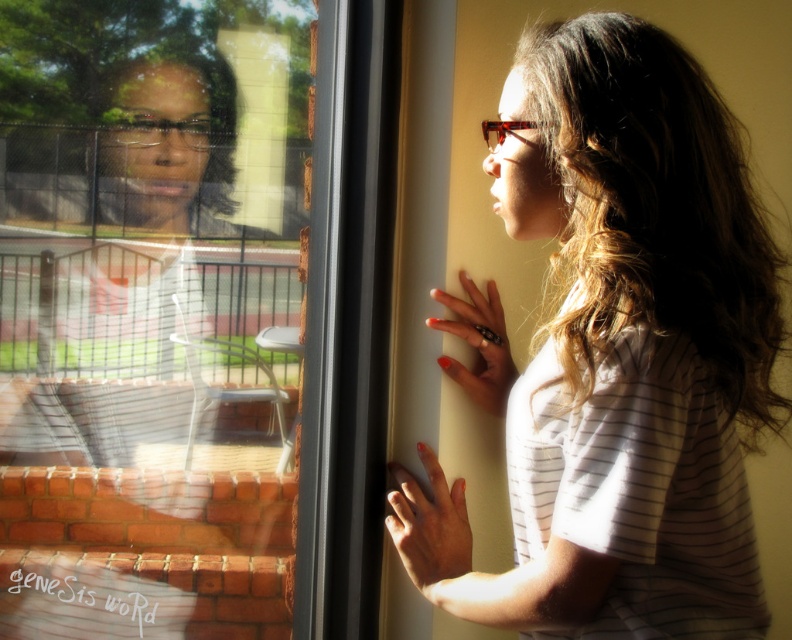
Question: Is transparent glass screen door at left below matte white shirt at center?

Choices:
 (A) no
 (B) yes

Answer: (B)

Question: Can you confirm if transparent glass screen door at left is smaller than matte white shirt at center?

Choices:
 (A) no
 (B) yes

Answer: (A)

Question: Among these objects, which one is nearest to the camera?

Choices:
 (A) transparent glass screen door at left
 (B) matte white shirt at center

Answer: (B)

Question: Among these points, which one is nearest to the camera?

Choices:
 (A) (671, 104)
 (B) (225, 412)

Answer: (A)

Question: Which point is farther to the camera?

Choices:
 (A) (97, 179)
 (B) (699, 234)

Answer: (A)

Question: Does transparent glass screen door at left have a smaller size compared to matte white shirt at center?

Choices:
 (A) no
 (B) yes

Answer: (A)